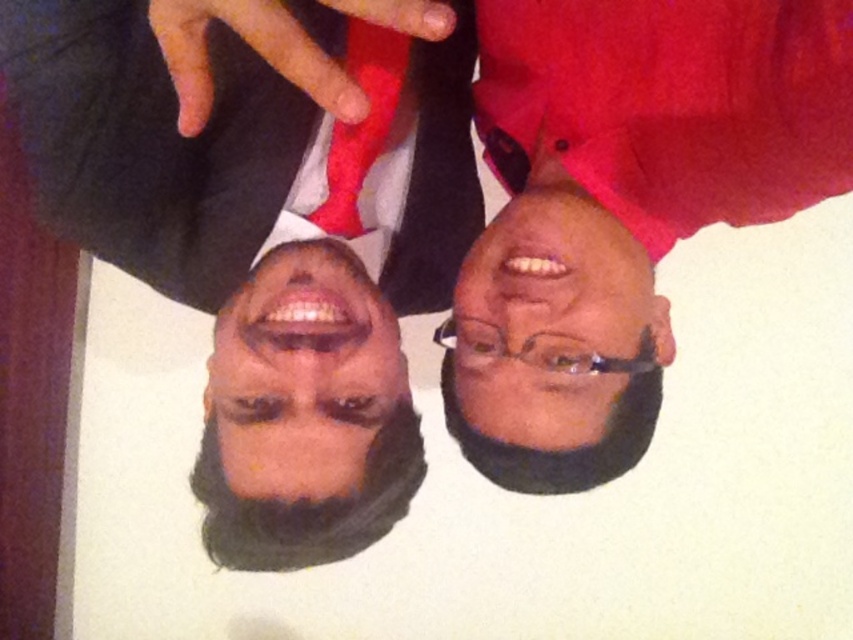
Is smooth skin face at center taller than matte red fabric at upper center?

Yes, smooth skin face at center is taller than matte red fabric at upper center.

Can you confirm if smooth skin face at center is thinner than matte red fabric at upper center?

In fact, smooth skin face at center might be wider than matte red fabric at upper center.

Where is `smooth skin face at center`? The image size is (853, 640). smooth skin face at center is located at coordinates (303, 374).

Is matte black glasses at center bigger than smooth skin face at center?

Yes, matte black glasses at center is bigger than smooth skin face at center.

What do you see at coordinates (550, 321) in the screenshot? The height and width of the screenshot is (640, 853). I see `matte black glasses at center` at bounding box center [550, 321].

This screenshot has width=853, height=640. I want to click on matte black glasses at center, so click(550, 321).

Which is above, smooth skin face at center or matte red tie at center?

Positioned higher is matte red tie at center.

Is smooth skin face at center smaller than matte red tie at center?

Incorrect, smooth skin face at center is not smaller in size than matte red tie at center.

The width and height of the screenshot is (853, 640). I want to click on smooth skin face at center, so click(303, 374).